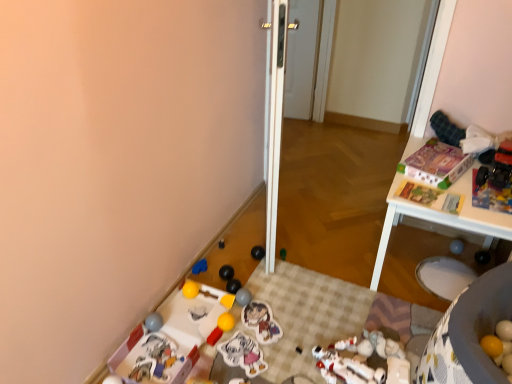
Where is `vacant area that lies between white matte robot at lower center, the 15th toy viewed from the left, and matte gray ball at center, which ranks as the 10th toy in right-to-left order`? vacant area that lies between white matte robot at lower center, the 15th toy viewed from the left, and matte gray ball at center, which ranks as the 10th toy in right-to-left order is located at coordinates (284, 332).